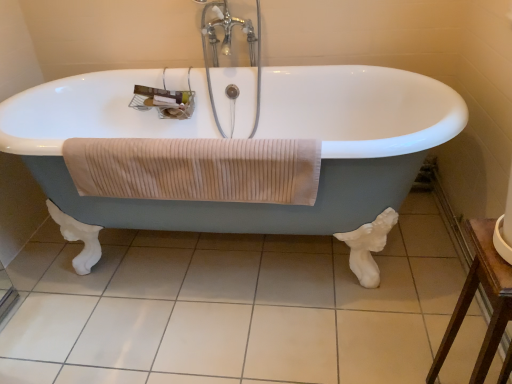
Question: Can you confirm if beige ribbed towel at center is taller than brown wooden table at lower right?

Choices:
 (A) yes
 (B) no

Answer: (B)

Question: Can you confirm if beige ribbed towel at center is bigger than brown wooden table at lower right?

Choices:
 (A) no
 (B) yes

Answer: (A)

Question: From the image's perspective, is beige ribbed towel at center located beneath brown wooden table at lower right?

Choices:
 (A) no
 (B) yes

Answer: (A)

Question: Is beige ribbed towel at center positioned in front of brown wooden table at lower right?

Choices:
 (A) yes
 (B) no

Answer: (B)

Question: Could you tell me if beige ribbed towel at center is facing brown wooden table at lower right?

Choices:
 (A) yes
 (B) no

Answer: (B)

Question: Is beige ribbed towel at center smaller than brown wooden table at lower right?

Choices:
 (A) yes
 (B) no

Answer: (A)

Question: Considering the relative sizes of white tile at center and chrome metallic faucet at upper center in the image provided, is white tile at center taller than chrome metallic faucet at upper center?

Choices:
 (A) yes
 (B) no

Answer: (B)

Question: From the image's perspective, does white tile at center appear lower than chrome metallic faucet at upper center?

Choices:
 (A) no
 (B) yes

Answer: (B)

Question: Does white tile at center have a smaller size compared to chrome metallic faucet at upper center?

Choices:
 (A) yes
 (B) no

Answer: (B)

Question: From a real-world perspective, is white tile at center under chrome metallic faucet at upper center?

Choices:
 (A) no
 (B) yes

Answer: (B)

Question: Can you confirm if white tile at center is positioned to the right of chrome metallic faucet at upper center?

Choices:
 (A) no
 (B) yes

Answer: (A)

Question: Is white tile at center positioned with its back to chrome metallic faucet at upper center?

Choices:
 (A) yes
 (B) no

Answer: (B)

Question: Is white tile at center thinner than beige ribbed towel at center?

Choices:
 (A) no
 (B) yes

Answer: (A)